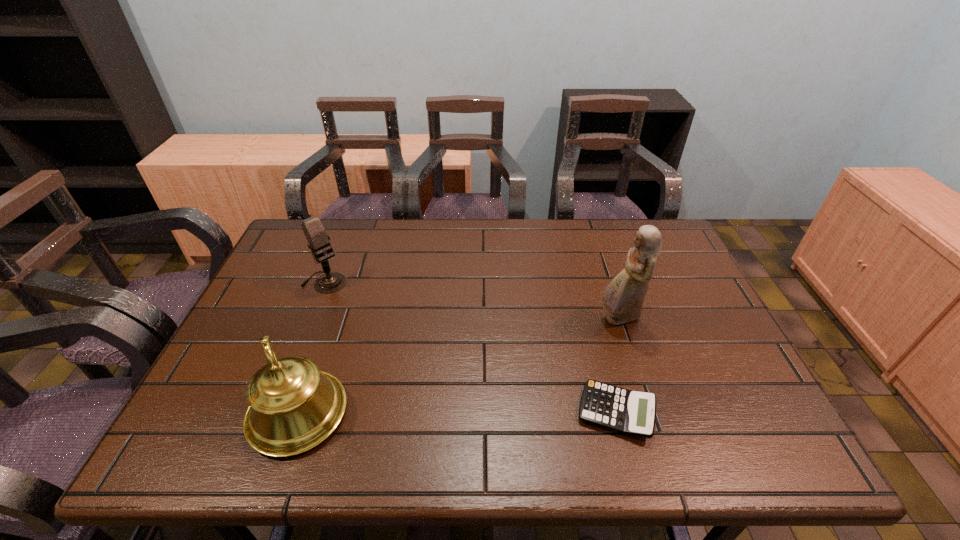
Where is `free area in between the microphone and the tallest object`? The width and height of the screenshot is (960, 540). free area in between the microphone and the tallest object is located at coordinates [x=471, y=300].

At what (x,y) coordinates should I click in order to perform the action: click on object that ranks as the second closest to the tallest object. Please return your answer as a coordinate pair (x, y). This screenshot has width=960, height=540. Looking at the image, I should click on (293, 406).

Select which object appears as the second closest to the third nearest object. Please provide its 2D coordinates. Your answer should be formatted as a tuple, i.e. [(x, y)], where the tuple contains the x and y coordinates of a point satisfying the conditions above.

[(293, 406)]